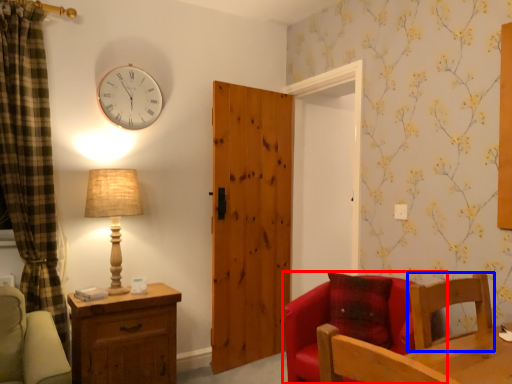
Question: Which object appears farthest to the camera in this image, chair (highlighted by a red box) or chair (highlighted by a blue box)?

Choices:
 (A) chair
 (B) chair

Answer: (A)